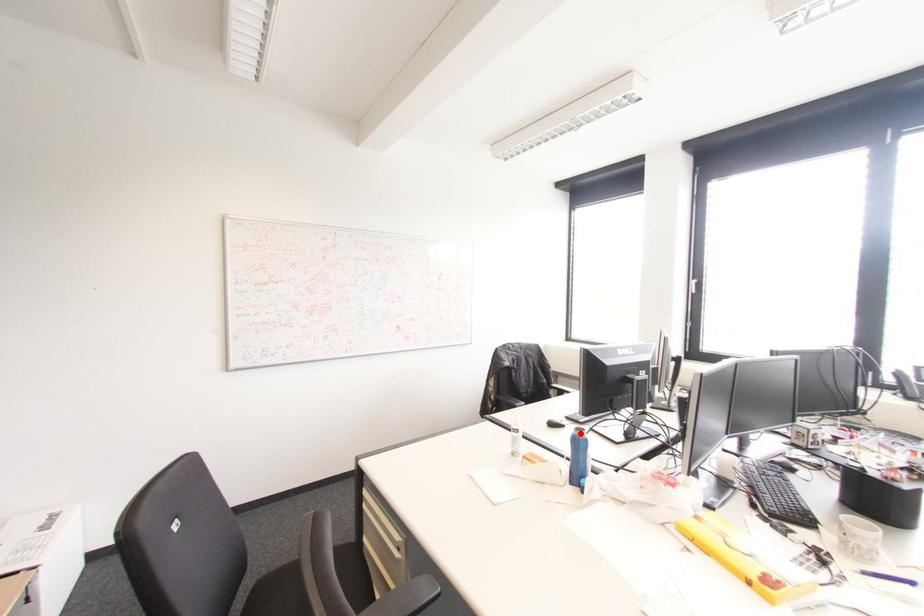
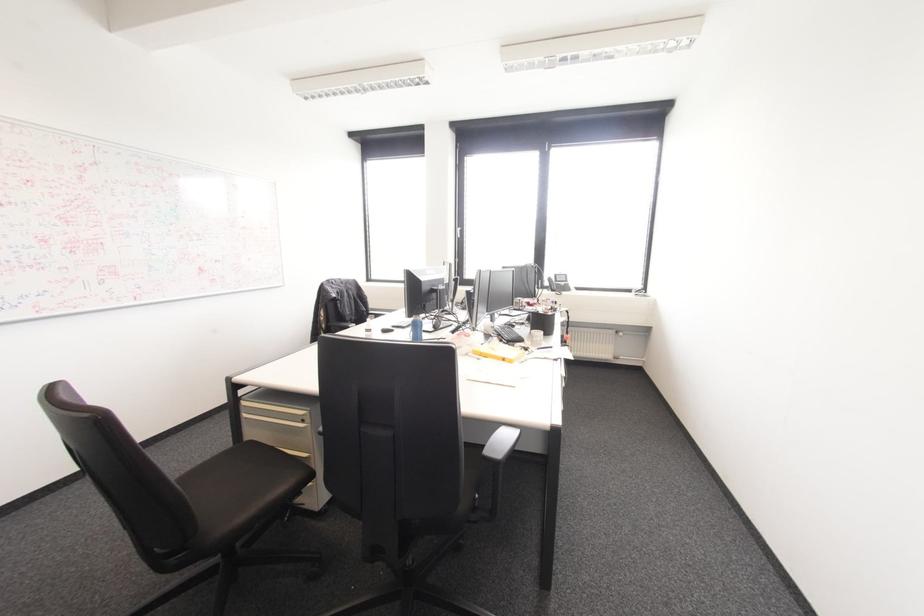
In the second image, find the point that corresponds to the highlighted location in the first image.

(418, 318)